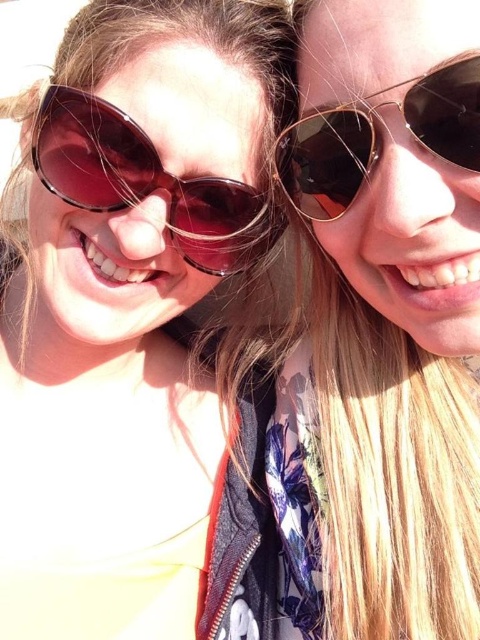
You are a photographer trying to adjust the lighting for a selfie. You notice two pairs of sunglasses in the frame. The matte black sunglasses at right and the matte brown sunglasses at left. Which sunglasses are lower in the image?

The matte black sunglasses at right is positioned under the matte brown sunglasses at left, so the matte black sunglasses at right are lower in the image.

You are a photographer trying to adjust the lighting for a portrait. You notice two pairs of sunglasses in the scene. Which pair of sunglasses, the matte black sunglasses at upper left or the matte brown sunglasses at left, is positioned higher up in the frame?

The matte black sunglasses at upper left is taller than the matte brown sunglasses at left, so the matte black sunglasses at upper left is positioned higher up in the frame.

You are taking a photo of two people in bright sunlight. You notice the matte black sunglasses at upper left in the image. Where exactly should you position your camera to ensure the sunglasses are clearly visible in the photo?

You should position your camera so that the matte black sunglasses at upper left are at point (137, 326) to ensure they are clearly visible.